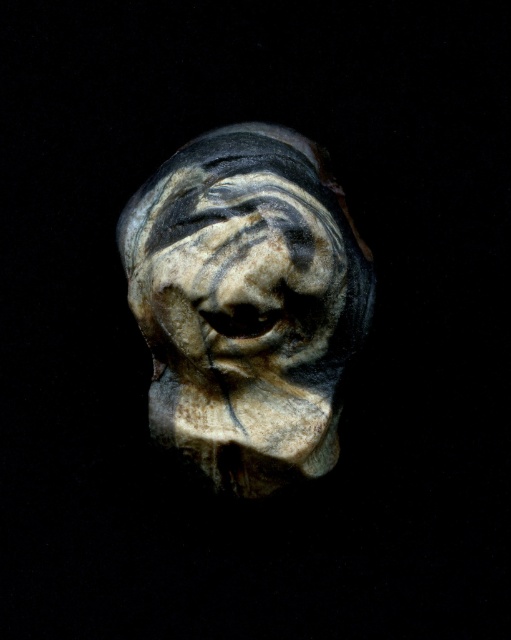
You are examining the sculpture from the front. There are two points on the sculpture labeled as point (223, 461) and point (194, 211). Which point is closer to your face?

Point (194, 211) is closer to your face because it is closer to the camera than point (223, 461).

You are an art restorer examining the speckled stone head at center and the speckled stone face at center in the image. Which object is located lower in the scene?

The speckled stone head at center is positioned under the speckled stone face at center, so it is located lower in the scene.

You are an art conservator examining the speckled stone head at center. What are the coordinates of its position in the image?

The speckled stone head at center is located at coordinates [246,304].